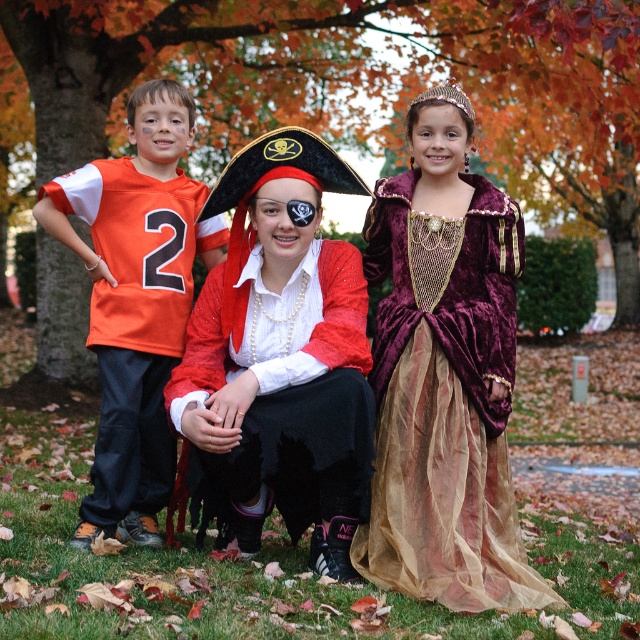
You are a photographer trying to capture a group photo of the shiny red fabric pirate costume at center and the orange jersey at left. Based on their positions, which child should stand lower in the frame to ensure both are fully visible?

The shiny red fabric pirate costume at center should stand lower in the frame because it is located below the orange jersey at left, so adjusting their position will help ensure both are fully visible.

You are a photographer trying to capture a group photo of the three children in the scene. The velvet maroon dress at center is at point 0.588, 0.695. Where should you position the camera to ensure all three children are in frame?

The velvet maroon dress at center is at point (444, 376), so positioning the camera centrally would ensure all three children are in frame.

You are a photographer trying to capture a group photo of the three children. You notice two children in the center are wearing the velvet maroon dress at center and the shiny red fabric pirate costume at center. Which one should you position slightly to the left to ensure all three are centered in the frame?

You should position the shiny red fabric pirate costume at center slightly to the left because the velvet maroon dress at center is currently to the right of the shiny red fabric pirate costume at center, so moving the pirate costume left would help center them all.